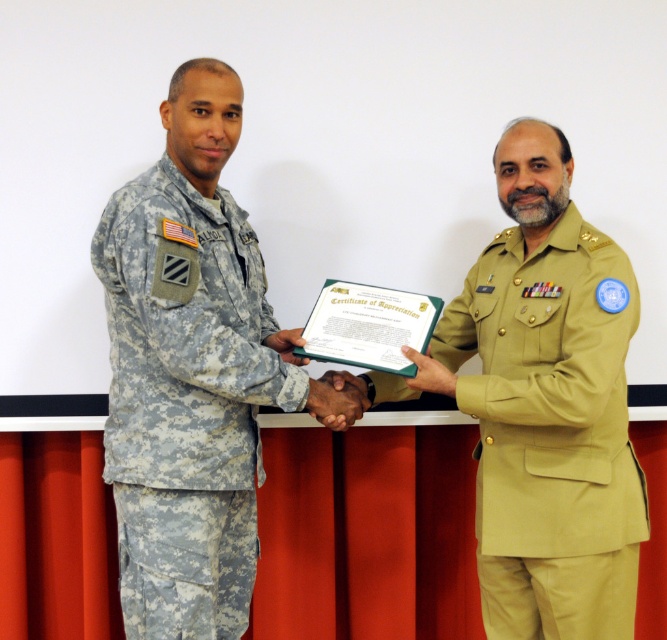
You are a tailor measuring uniforms for alterations. You have two uniforms to adjust to fit a standard size. The camouflage fabric uniform at left and the khaki fabric uniform at right. Which uniform requires more fabric to be added to match the standard size?

The camouflage fabric uniform at left requires more fabric to be added to match the standard size because its width is larger than the khaki fabric uniform at right.